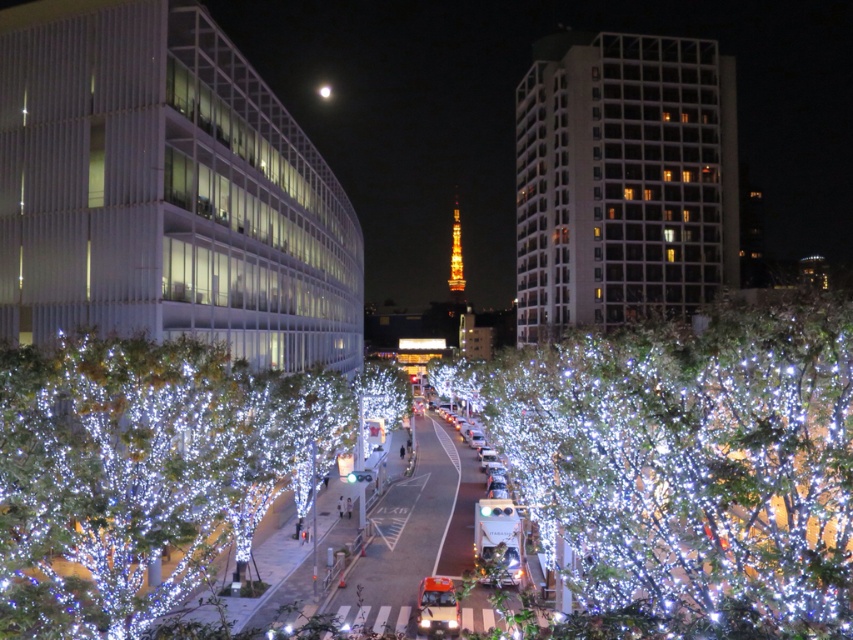
You are a photographer standing on the pedestrian crossing. You want to take a photo of the illuminated plastic tree at center and the illuminated plastic trees at center. Which one will appear larger in your photo?

The illuminated plastic tree at center will appear larger in your photo because it is bigger than the illuminated plastic trees at center.

You are standing at the pedestrian crossing and want to take a photo of the illuminated plastic tree at center. Based on your current position, where should you aim your camera to capture it?

You should aim your camera towards the center of the image, specifically at the coordinates point (689, 465), where the illuminated plastic tree at center is located.

You are standing at the pedestrian crossing and want to reach a point that is 44.31 meters away from your current position. Is the point at coordinates point (x=807, y=588) in the image within your reach if you can walk 50 meters?

The point at point (x=807, y=588) is 44.31 meters away from the viewer. Since you can walk 50 meters, you can reach it.